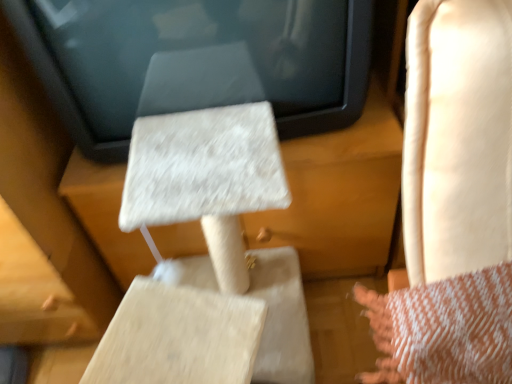
The width and height of the screenshot is (512, 384). I want to click on empty space that is ontop of beige textured cat tree at center, so coord(197,157).